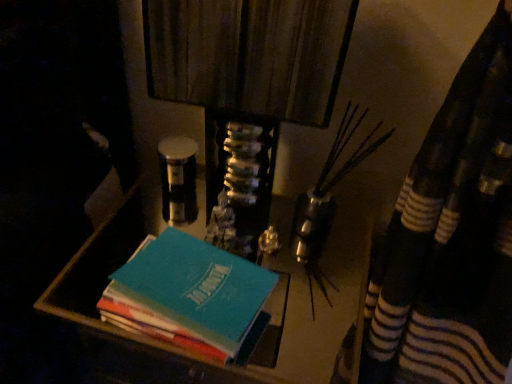
Question: From a real-world perspective, does teal matte book stack at center stand above teal matte book at center?

Choices:
 (A) yes
 (B) no

Answer: (B)

Question: Is teal matte book stack at center smaller than teal matte book at center?

Choices:
 (A) yes
 (B) no

Answer: (B)

Question: Is teal matte book stack at center shorter than teal matte book at center?

Choices:
 (A) no
 (B) yes

Answer: (A)

Question: Does teal matte book stack at center have a lesser width compared to teal matte book at center?

Choices:
 (A) yes
 (B) no

Answer: (B)

Question: Is teal matte book stack at center completely or partially outside of teal matte book at center?

Choices:
 (A) no
 (B) yes

Answer: (B)

Question: Considering the relative sizes of teal matte book stack at center and teal matte book at center in the image provided, is teal matte book stack at center bigger than teal matte book at center?

Choices:
 (A) yes
 (B) no

Answer: (A)

Question: From a real-world perspective, is teal matte book at center under teal matte book stack at center?

Choices:
 (A) yes
 (B) no

Answer: (B)

Question: Is teal matte book at center completely or partially outside of teal matte book stack at center?

Choices:
 (A) no
 (B) yes

Answer: (B)

Question: Does teal matte book at center have a greater height compared to teal matte book stack at center?

Choices:
 (A) yes
 (B) no

Answer: (B)

Question: Is teal matte book at center positioned behind teal matte book stack at center?

Choices:
 (A) no
 (B) yes

Answer: (A)

Question: From a real-world perspective, is teal matte book at center on top of teal matte book stack at center?

Choices:
 (A) yes
 (B) no

Answer: (A)

Question: Does teal matte book at center appear on the left side of teal matte book stack at center?

Choices:
 (A) yes
 (B) no

Answer: (A)

Question: Relative to teal matte book stack at center, is teal matte book at center in front or behind?

Choices:
 (A) front
 (B) behind

Answer: (A)